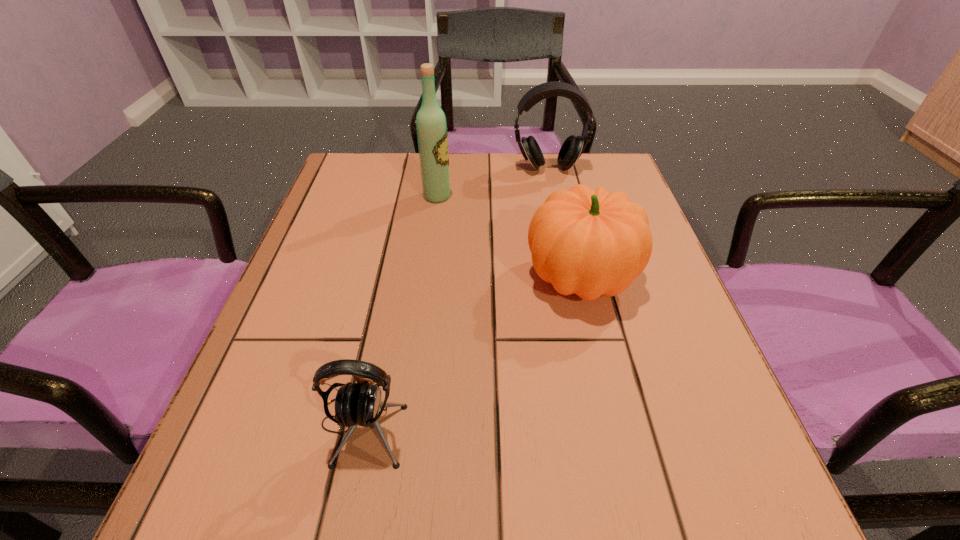
Where is `free spot that satisfies the following two spatial constraints: 1. on the ear cups of the farthest object; 2. on the right side of the pumpkin`? Image resolution: width=960 pixels, height=540 pixels. free spot that satisfies the following two spatial constraints: 1. on the ear cups of the farthest object; 2. on the right side of the pumpkin is located at coordinates (572, 278).

Where is `free space that satisfies the following two spatial constraints: 1. on the ear cups of the farthest object; 2. on the front-facing side of the second farthest object`? The height and width of the screenshot is (540, 960). free space that satisfies the following two spatial constraints: 1. on the ear cups of the farthest object; 2. on the front-facing side of the second farthest object is located at coordinates (554, 196).

You are a GUI agent. You are given a task and a screenshot of the screen. Output one action in this format:
    pyautogui.click(x=<x>, y=<y>)
    Task: Click on the vacant point that satisfies the following two spatial constraints: 1. on the ear cups of the farther earphone; 2. on the right side of the second nearest object
    
    Given the screenshot: What is the action you would take?
    pyautogui.click(x=572, y=278)

Where is `vacant space that satisfies the following two spatial constraints: 1. on the front-facing side of the wine bottle; 2. on the right side of the third farthest object`? vacant space that satisfies the following two spatial constraints: 1. on the front-facing side of the wine bottle; 2. on the right side of the third farthest object is located at coordinates (427, 278).

You are a GUI agent. You are given a task and a screenshot of the screen. Output one action in this format:
    pyautogui.click(x=<x>, y=<y>)
    Task: Click on the free space that satisfies the following two spatial constraints: 1. on the front-facing side of the wine bottle; 2. on the right side of the third farthest object
    
    Given the screenshot: What is the action you would take?
    pyautogui.click(x=427, y=278)